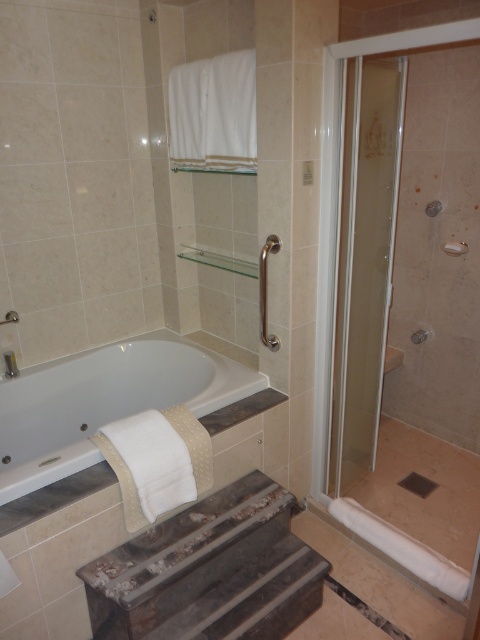
Question: Which point is closer to the camera?

Choices:
 (A) (55, 456)
 (B) (362, 188)

Answer: (A)

Question: Which point is farther to the camera?

Choices:
 (A) (151, 384)
 (B) (370, 96)

Answer: (A)

Question: Observing the image, what is the correct spatial positioning of clear glass shower door at right in reference to white fabric towel at lower left?

Choices:
 (A) above
 (B) below

Answer: (A)

Question: Does clear glass shower door at right appear on the left side of silver metallic towel bar at upper right?

Choices:
 (A) yes
 (B) no

Answer: (A)

Question: Estimate the real-world distances between objects in this image. Which object is closer to the white fabric towel at lower left?

Choices:
 (A) clear glass shower door at right
 (B) silver metallic towel bar at upper right

Answer: (A)

Question: Where is clear glass shower door at right located in relation to silver metallic towel bar at upper right in the image?

Choices:
 (A) left
 (B) right

Answer: (A)